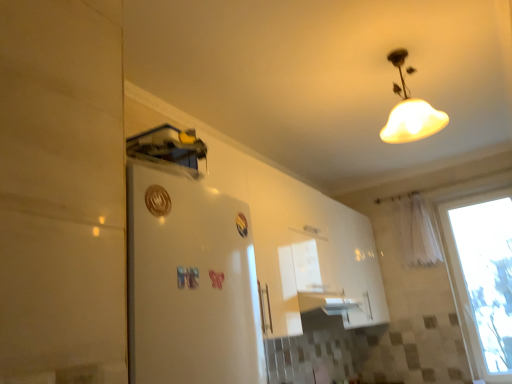
Question: Is white matte lampshade at upper center shorter than white sheer curtain at right?

Choices:
 (A) yes
 (B) no

Answer: (A)

Question: Does white matte lampshade at upper center come behind white sheer curtain at right?

Choices:
 (A) yes
 (B) no

Answer: (B)

Question: Does white matte lampshade at upper center appear on the right side of white sheer curtain at right?

Choices:
 (A) no
 (B) yes

Answer: (A)

Question: From the image's perspective, does white matte lampshade at upper center appear higher than white sheer curtain at right?

Choices:
 (A) no
 (B) yes

Answer: (B)

Question: Are white matte lampshade at upper center and white sheer curtain at right located far from each other?

Choices:
 (A) yes
 (B) no

Answer: (A)

Question: Considering their positions, is transparent glass window at right located in front of or behind white sheer curtain at right?

Choices:
 (A) behind
 (B) front

Answer: (B)

Question: Is point (458, 221) closer or farther from the camera than point (416, 223)?

Choices:
 (A) closer
 (B) farther

Answer: (A)

Question: From the image's perspective, is transparent glass window at right above or below white sheer curtain at right?

Choices:
 (A) above
 (B) below

Answer: (B)

Question: Choose the correct answer: Is transparent glass window at right inside white sheer curtain at right or outside it?

Choices:
 (A) outside
 (B) inside

Answer: (A)

Question: Is white matte lampshade at upper center to the left or to the right of white sheer curtain at right in the image?

Choices:
 (A) left
 (B) right

Answer: (A)

Question: Relative to white sheer curtain at right, is white matte lampshade at upper center in front or behind?

Choices:
 (A) behind
 (B) front

Answer: (B)

Question: From a real-world perspective, relative to white sheer curtain at right, is white matte lampshade at upper center vertically above or below?

Choices:
 (A) below
 (B) above

Answer: (B)

Question: Is point (420, 119) positioned closer to the camera than point (404, 249)?

Choices:
 (A) farther
 (B) closer

Answer: (B)

Question: From the image's perspective, is white sheer curtain at right located above or below transparent glass window at right?

Choices:
 (A) above
 (B) below

Answer: (A)

Question: Is point (420, 236) positioned closer to the camera than point (475, 375)?

Choices:
 (A) farther
 (B) closer

Answer: (A)